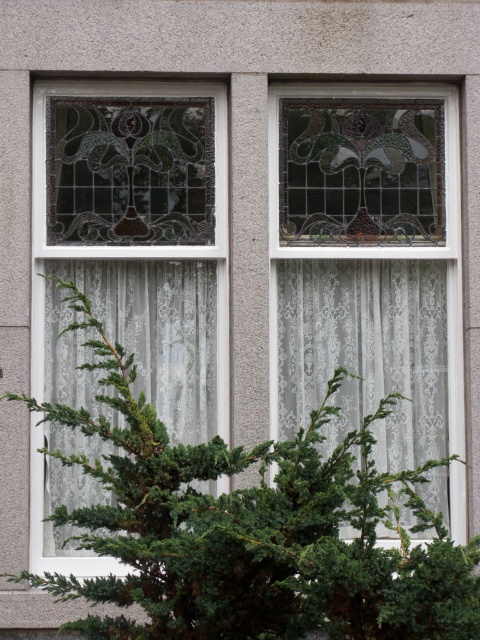
You are a window cleaner standing at the base of the building. You need to clean both the green leafy bush at center and the white lace curtain at left. Given that your ladder can extend up to 10 feet, can you safely reach both objects with the same ladder?

The distance between the green leafy bush at center and the white lace curtain at left is 9.75 feet. Since the ladder can extend up to 10 feet, it is within the safe range, so yes, you can safely reach both objects with the same ladder.

You are standing in front of the building facade and want to place a decorative pot exactly at the center of the green leafy bush at center. According to the coordinates provided, what are the coordinates where you should place the pot?

The coordinates for placing the decorative pot exactly at the center of the green leafy bush at center are at point (251,529).